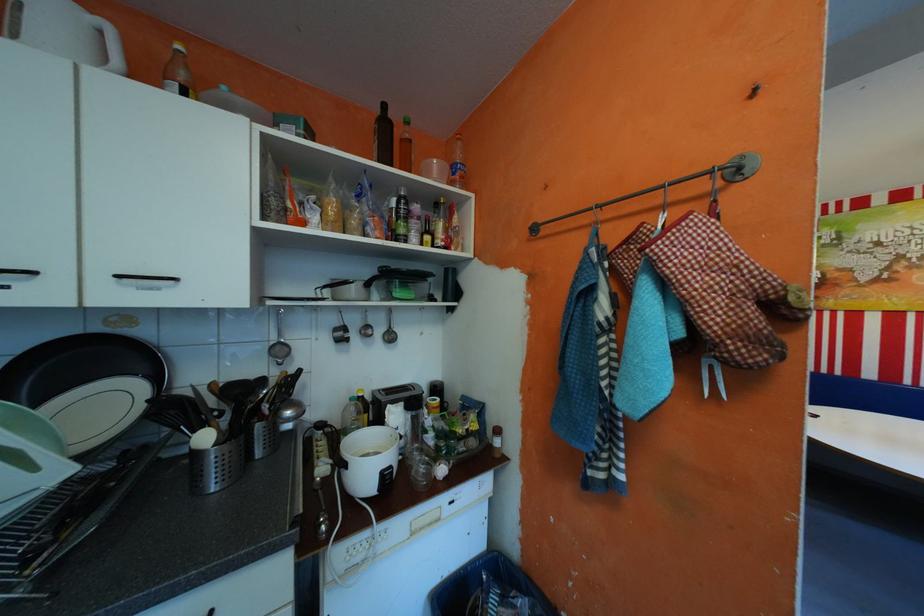
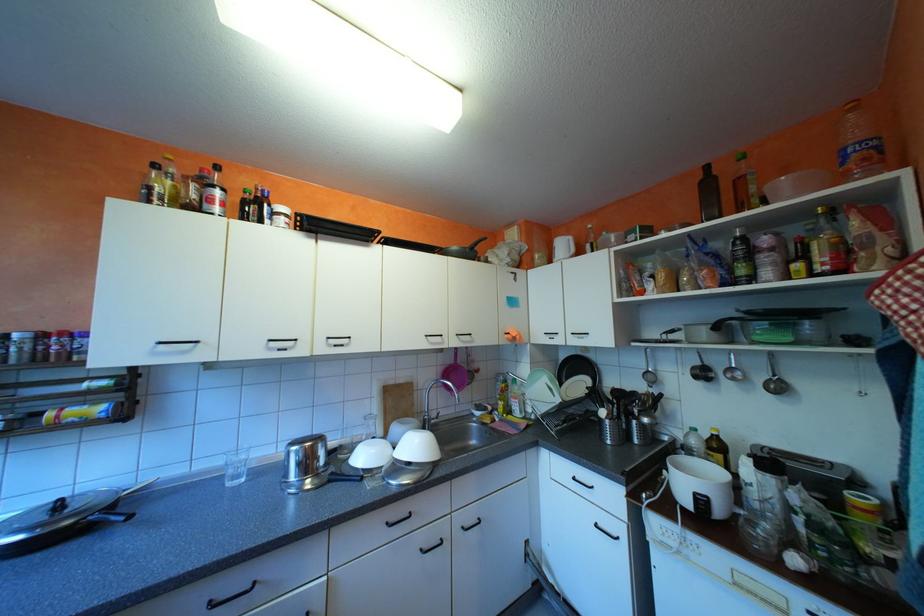
In the second image, find the point that corresponds to (x=418, y=407) in the first image.

(771, 464)